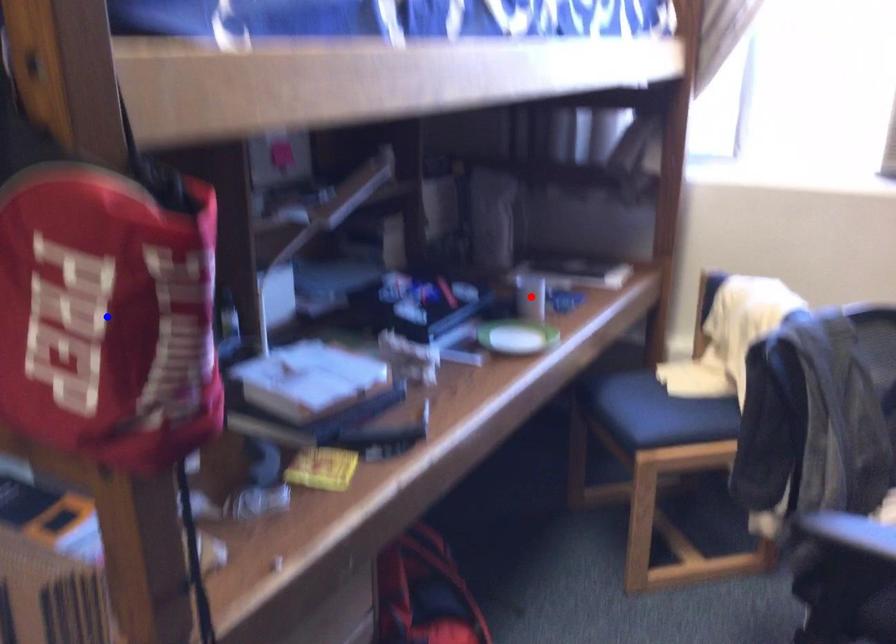
Question: In the image, two points are highlighted. Which point is nearer to the camera? Reply with the corresponding letter.

Choices:
 (A) blue point
 (B) red point

Answer: (A)